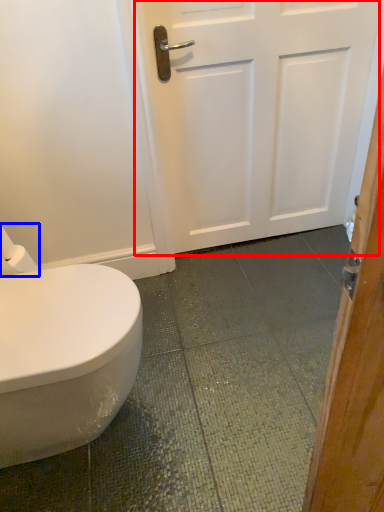
Question: Which point is closer to the camera, door (highlighted by a red box) or toilet paper (highlighted by a blue box)?

Choices:
 (A) door
 (B) toilet paper

Answer: (B)